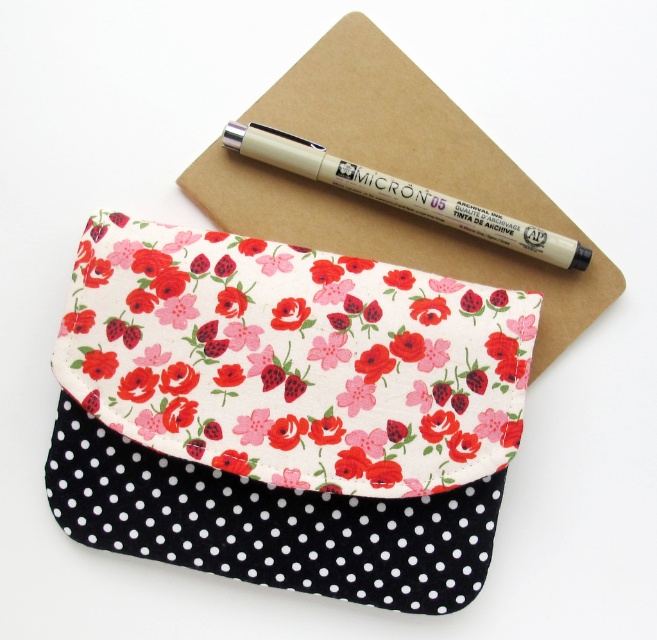
Who is taller, floral fabric notepad at upper center or matte beige pen at upper center?

With more height is floral fabric notepad at upper center.

Is floral fabric notepad at upper center positioned in front of matte beige pen at upper center?

That is False.

The width and height of the screenshot is (657, 640). Identify the location of floral fabric notepad at upper center. (397, 176).

You are a GUI agent. You are given a task and a screenshot of the screen. Output one action in this format:
    pyautogui.click(x=<x>, y=<y>)
    Task: Click on the floral fabric notepad at upper center
    
    Given the screenshot: What is the action you would take?
    pyautogui.click(x=397, y=176)

How far apart are floral fabric notepad at upper center and floral fabric flower at upper center?

A distance of 7.97 inches exists between floral fabric notepad at upper center and floral fabric flower at upper center.

Can you confirm if floral fabric notepad at upper center is thinner than floral fabric flower at upper center?

Incorrect, floral fabric notepad at upper center's width is not less than floral fabric flower at upper center's.

Between point (440, 109) and point (397, 269), which one is positioned in front?

Point (397, 269) is more forward.

The height and width of the screenshot is (640, 657). What are the coordinates of `floral fabric notepad at upper center` in the screenshot? It's located at (397, 176).

Between floral fabric flower at center and floral fabric flower at upper center, which one is positioned lower?

floral fabric flower at center is below.

Which is behind, point (296, 321) or point (401, 272)?

Positioned behind is point (401, 272).

Is point (296, 300) farther from camera compared to point (403, 288)?

No, (296, 300) is closer to viewer.

Find the location of a particular element. This screenshot has height=640, width=657. floral fabric flower at center is located at coordinates (288, 314).